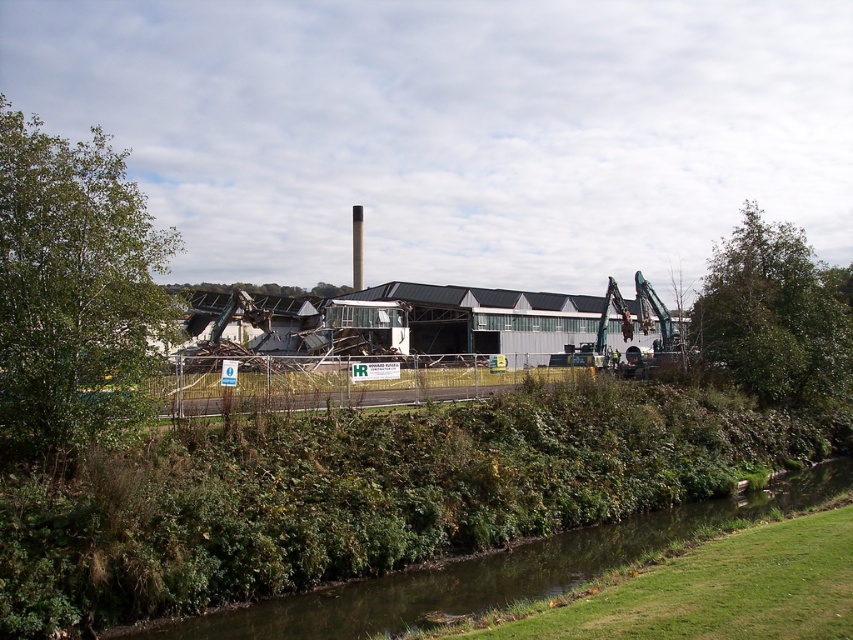
What do you see at coordinates (494, 570) in the screenshot? Image resolution: width=853 pixels, height=640 pixels. I see `green grassy river at lower center` at bounding box center [494, 570].

Is green grassy river at lower center closer to the viewer compared to green leafy tree at upper right?

Yes, green grassy river at lower center is closer to the viewer.

Does point (314, 630) come in front of point (733, 259)?

Yes, point (314, 630) is in front of point (733, 259).

You are a GUI agent. You are given a task and a screenshot of the screen. Output one action in this format:
    pyautogui.click(x=<x>, y=<y>)
    Task: Click on the green grassy river at lower center
    The height and width of the screenshot is (640, 853).
    Given the screenshot: What is the action you would take?
    pyautogui.click(x=494, y=570)

Is point (96, 205) closer to viewer compared to point (553, 557)?

Yes, point (96, 205) is in front of point (553, 557).

The image size is (853, 640). What do you see at coordinates (73, 292) in the screenshot?
I see `green leafy tree at left` at bounding box center [73, 292].

Image resolution: width=853 pixels, height=640 pixels. Identify the location of green leafy tree at left. (73, 292).

Image resolution: width=853 pixels, height=640 pixels. What are the coordinates of `green leafy tree at left` in the screenshot? It's located at (73, 292).

Is green leafy tree at left below green leafy tree at upper right?

Actually, green leafy tree at left is above green leafy tree at upper right.

Is point (126, 396) positioned before point (820, 344)?

Yes, point (126, 396) is in front of point (820, 344).

This screenshot has height=640, width=853. I want to click on green leafy tree at left, so (x=73, y=292).